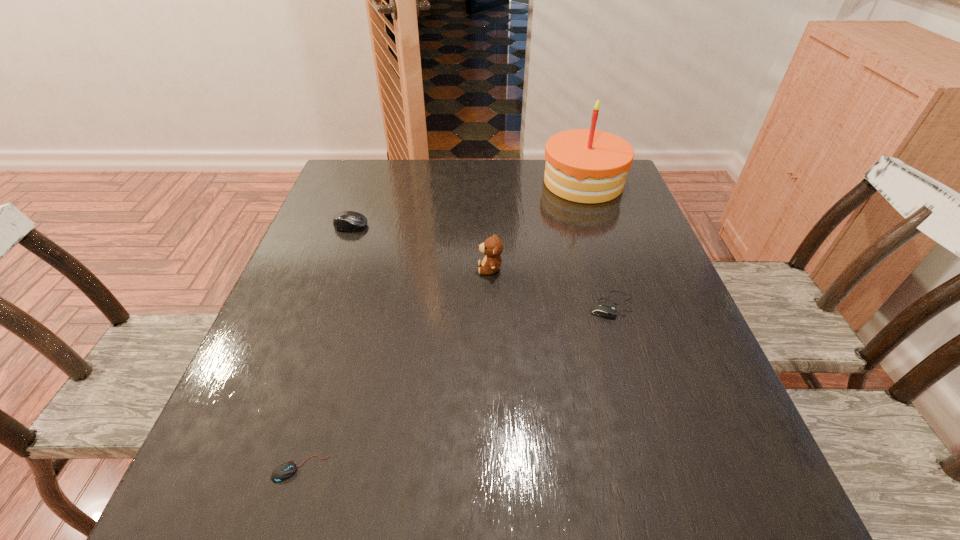
Where is `empty location between the nearest object and the teddy bear`? The image size is (960, 540). empty location between the nearest object and the teddy bear is located at coordinates (396, 369).

Find the location of a particular element. The width and height of the screenshot is (960, 540). blank region between the birthday cake and the third shortest object is located at coordinates (468, 204).

This screenshot has width=960, height=540. I want to click on vacant area between the nearest mouse and the second farthest mouse, so click(x=456, y=387).

This screenshot has width=960, height=540. In order to click on free space between the third farthest object and the tallest object in this screenshot , I will do `click(537, 225)`.

The height and width of the screenshot is (540, 960). Identify the location of free space that is in between the second farthest object and the second tallest object. (420, 247).

What are the coordinates of `free point between the second tallest mouse and the second tallest object` in the screenshot? It's located at (551, 287).

Where is `the third closest object to the birthday cake`? the third closest object to the birthday cake is located at coordinates (346, 220).

Locate an element on the screen. object that is the nearest to the farthest mouse is located at coordinates (492, 247).

This screenshot has width=960, height=540. Find the location of `the second closest mouse to the shortest object`. the second closest mouse to the shortest object is located at coordinates (346, 220).

In order to click on the closest mouse relative to the fourth shortest object in this screenshot , I will do `click(601, 309)`.